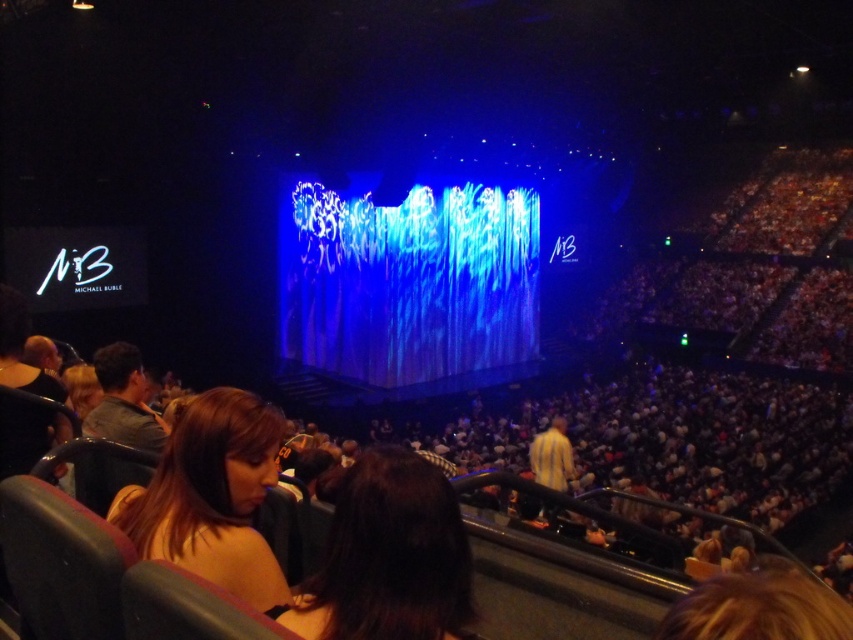
Question: Which point is closer to the camera taking this photo?

Choices:
 (A) (119, 368)
 (B) (383, 547)

Answer: (B)

Question: Can you confirm if brown hair at center is positioned to the right of gray fabric jacket at left?

Choices:
 (A) yes
 (B) no

Answer: (A)

Question: In this image, where is brown hair at lower left located relative to gray fabric jacket at left?

Choices:
 (A) right
 (B) left

Answer: (A)

Question: Estimate the real-world distances between objects in this image. Which object is farther from the brown hair at lower left?

Choices:
 (A) brown hair at center
 (B) gray fabric jacket at left

Answer: (B)

Question: Does brown hair at center have a larger size compared to brown hair at lower left?

Choices:
 (A) no
 (B) yes

Answer: (A)

Question: Which of the following is the closest to the observer?

Choices:
 (A) brown hair at lower left
 (B) gray fabric jacket at left
 (C) brown hair at center

Answer: (C)